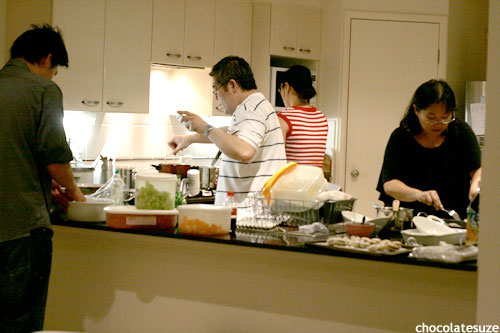
The image size is (500, 333). I want to click on wire rack, so click(277, 211).